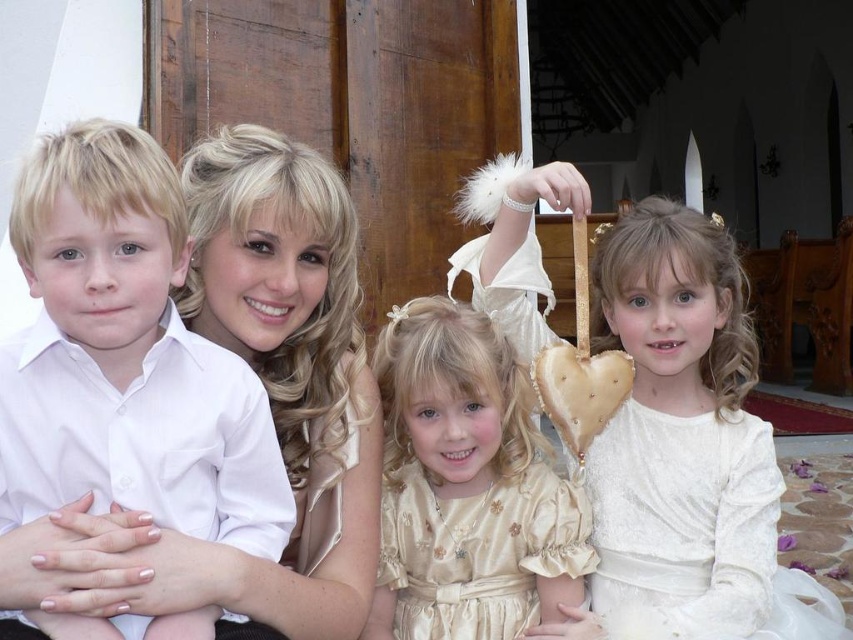
Who is lower down, gold satin dress at center or white satin dress at lower right?

white satin dress at lower right is below.

Is gold satin dress at center smaller than white satin dress at lower right?

Correct, gold satin dress at center occupies less space than white satin dress at lower right.

Identify the location of gold satin dress at center. (467, 486).

Which is below, matte gold heart at center or white satin dress at lower right?

Positioned lower is white satin dress at lower right.

Which is more to the right, matte gold heart at center or white satin dress at lower right?

matte gold heart at center is more to the right.

Which is in front, point (735, 586) or point (653, 572)?

Point (735, 586) is more forward.

In order to click on matte gold heart at center in this screenshot , I will do `click(686, 449)`.

Is point (670, 340) farther from camera compared to point (456, 548)?

Yes, point (670, 340) is behind point (456, 548).

What do you see at coordinates (686, 449) in the screenshot?
I see `matte gold heart at center` at bounding box center [686, 449].

Find the location of `matte gold heart at center`. matte gold heart at center is located at coordinates (686, 449).

You are a GUI agent. You are given a task and a screenshot of the screen. Output one action in this format:
    pyautogui.click(x=<x>, y=<y>)
    Task: Click on the matte gold heart at center
    
    Given the screenshot: What is the action you would take?
    pyautogui.click(x=686, y=449)